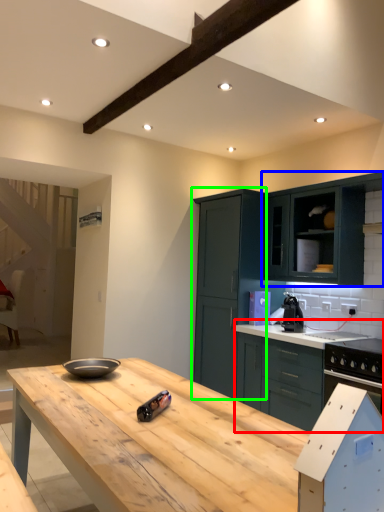
Question: Which is nearer to the cabinetry (highlighted by a red box)? cabinetry (highlighted by a blue box) or cabinetry (highlighted by a green box).

Choices:
 (A) cabinetry
 (B) cabinetry

Answer: (B)